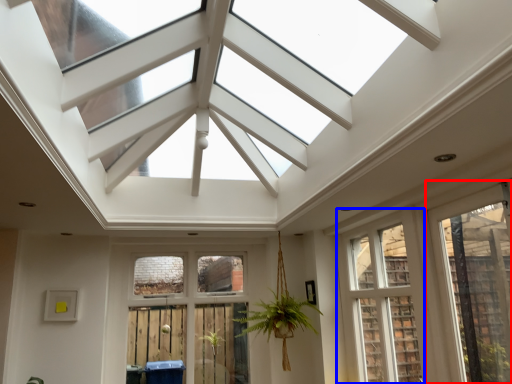
Question: Which of the following is the farthest to the observer, window (highlighted by a red box) or window (highlighted by a blue box)?

Choices:
 (A) window
 (B) window

Answer: (B)